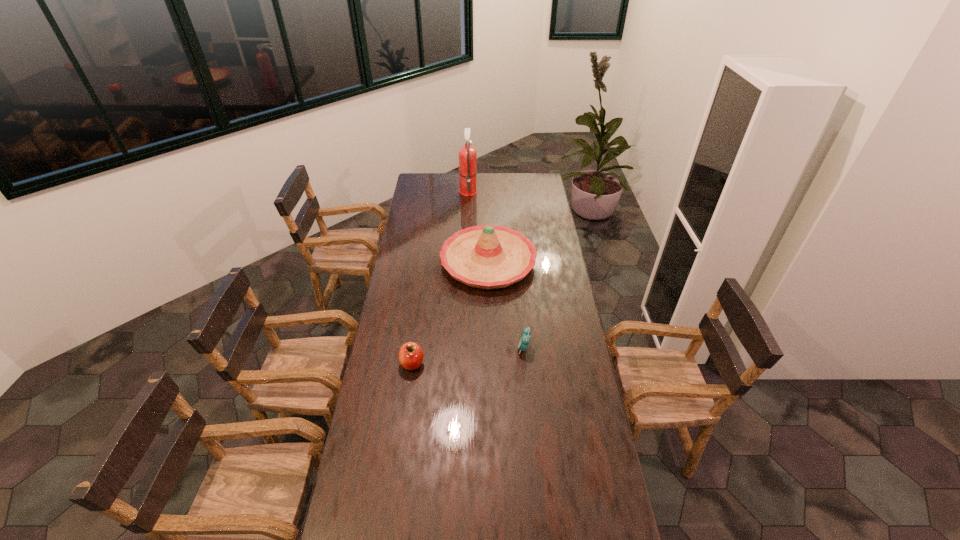
Locate an element on the screen. vacant point located 0.270m on the face of the alarm clock is located at coordinates (453, 348).

Identify the location of vacant space situated 0.220m on the right of the leftmost object. (478, 363).

The width and height of the screenshot is (960, 540). I want to click on object that is positioned at the far edge, so click(x=467, y=155).

At what (x,y) coordinates should I click in order to perform the action: click on object located in the left edge section of the desktop. Please return your answer as a coordinate pair (x, y). The height and width of the screenshot is (540, 960). Looking at the image, I should click on (410, 356).

Where is `object present at the right edge`? object present at the right edge is located at coordinates (488, 257).

Image resolution: width=960 pixels, height=540 pixels. What are the coordinates of `blank space at the left edge of the desktop` in the screenshot? It's located at (384, 333).

Find the location of a particular element. This screenshot has height=540, width=960. blank space at the right edge of the desktop is located at coordinates (552, 223).

Where is `empty space that is in between the leftmost object and the alarm clock`? The image size is (960, 540). empty space that is in between the leftmost object and the alarm clock is located at coordinates (468, 356).

Image resolution: width=960 pixels, height=540 pixels. I want to click on free space between the alarm clock and the sombrero, so click(506, 305).

Where is `unoccupied position between the tallest object and the leftmost object`? unoccupied position between the tallest object and the leftmost object is located at coordinates (441, 277).